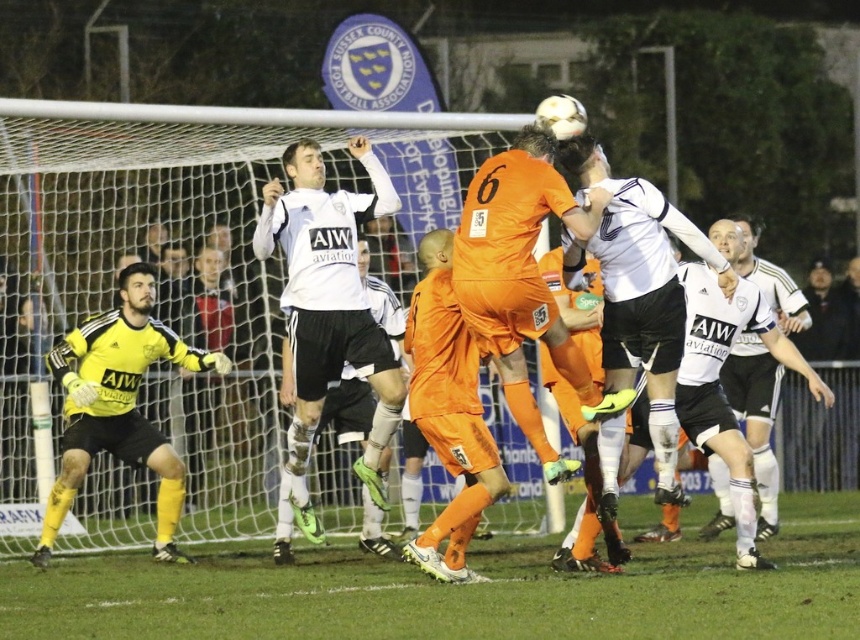
You are a soccer fan watching the match. The white mesh net at center and yellow matte gloves at left are in your view. Which object is wider?

The yellow matte gloves at left are wider than the white mesh net at center.

You are a sports analyst watching the game. You notice two players at the center of the image, the orange jersey at center and the white matte soccer player at center. Which player appears smaller in the image?

The orange jersey at center appears smaller in the image because it occupies less space than the white matte soccer player at center.